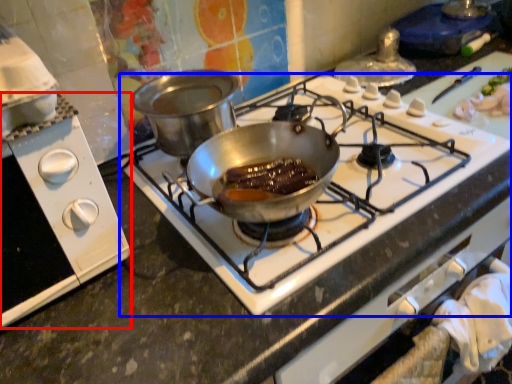
Question: Which of the following is the farthest to the observer, kitchen appliance (highlighted by a red box) or gas stove (highlighted by a blue box)?

Choices:
 (A) kitchen appliance
 (B) gas stove

Answer: (B)